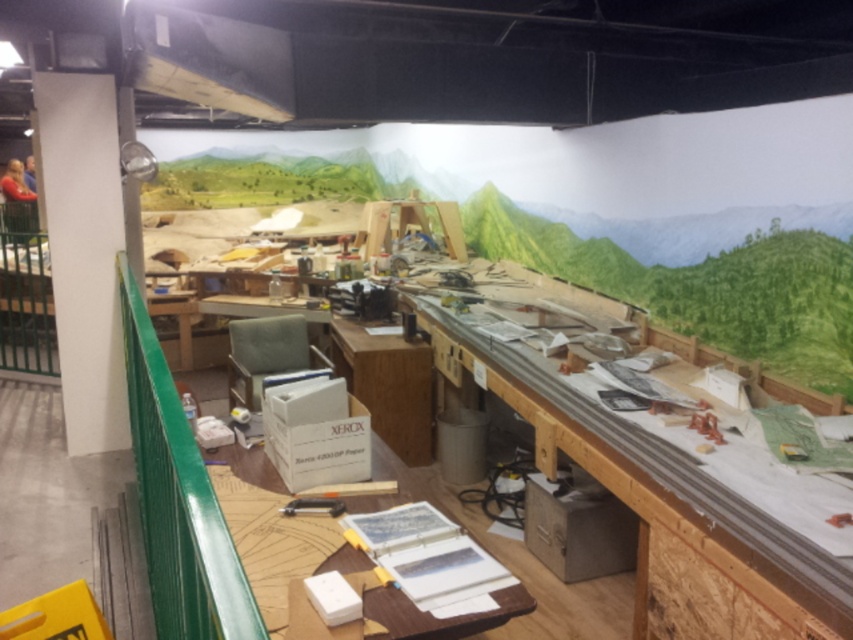
You are an interior designer planning to place a new sofa in this studio. The sofa is 1.2 meters wide. There is space between the white smooth pillar at left and the wooden at center. Can the sofa fit in that space?

The white smooth pillar at left is to the left of wooden at center, but the exact distance between them isn not provided in the objects description. Therefore, it is uncertain whether the 1.2 meter wide sofa can fit in that space.

You are standing at the entrance of the studio and want to reach the wooden table at center. According to the coordinates provided, in which direction should you move from your current position to reach it?

The wooden table at center is located at coordinates point (657,500). Since coordinates typically increase from the bottom left corner, moving towards the upper right direction would lead you to the wooden table at center.

Looking at this image, you are standing in the workshop and need to locate the white smooth pillar at left. According to the mural on the wall, which direction should you face to see the pillar in your line of sight?

The white smooth pillar at left is located at point (84, 252), so you should face towards the left side of the workshop to see it in your line of sight.